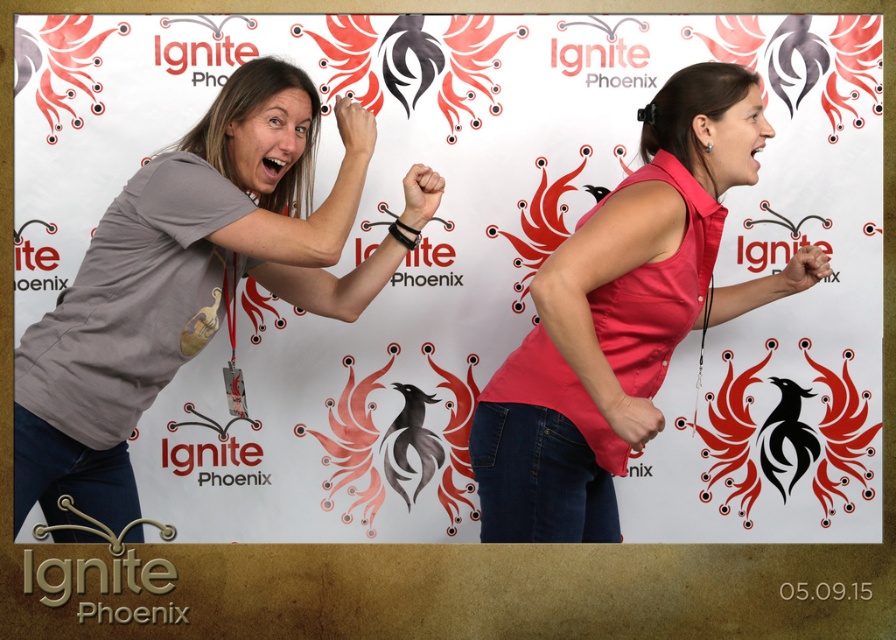
Question: Does matte gray t-shirt at left have a lesser width compared to matte pink sleeveless shirt at center?

Choices:
 (A) yes
 (B) no

Answer: (B)

Question: Can you confirm if matte gray t-shirt at left is bigger than matte pink sleeveless shirt at center?

Choices:
 (A) yes
 (B) no

Answer: (A)

Question: Which point is farther from the camera taking this photo?

Choices:
 (A) (707, 179)
 (B) (298, 90)

Answer: (B)

Question: Which object appears closest to the camera in this image?

Choices:
 (A) matte gray t-shirt at left
 (B) matte pink sleeveless shirt at center

Answer: (A)

Question: Does matte gray t-shirt at left have a greater width compared to matte pink sleeveless shirt at center?

Choices:
 (A) yes
 (B) no

Answer: (A)